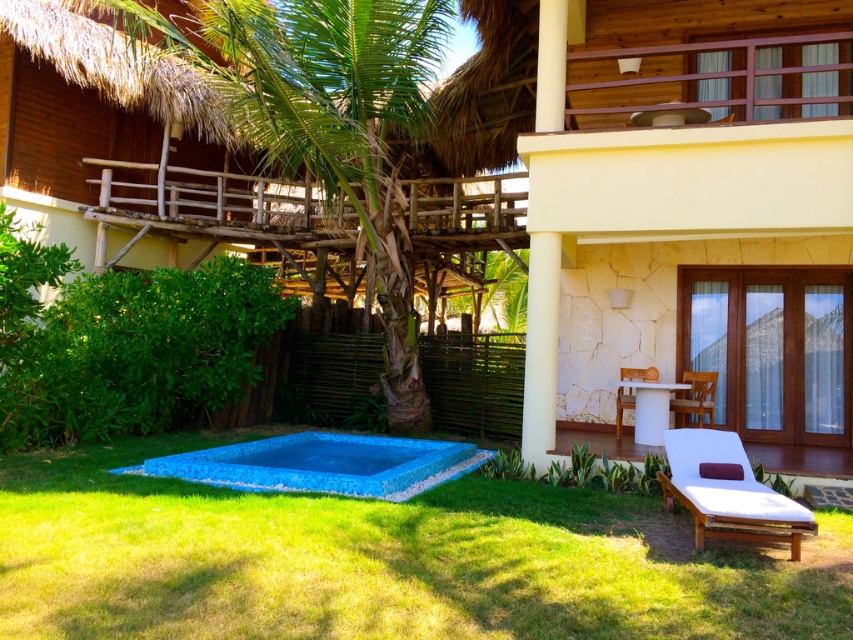
You are standing at the edge of the blue mosaic tiles at center and want to walk towards the green grass at lower center. In which direction should you move?

You should move to the right to reach the green grass at lower center since it is located to the right of the blue mosaic tiles at center.

Based on the photo, you are standing at the edge of the pool and want to walk to the white fabric chaise lounge at lower right. Which direction should you head to avoid stepping on the green grass at lower center?

You should head to the right of the white fabric chaise lounge at lower right to avoid stepping on the green grass at lower center, since the green grass at lower center is located to the left of the white fabric chaise lounge at lower right.

You are planning to lay a picnic blanket in the area shown. Considering the space available, which area would you choose between the green grass at lower center and the blue mosaic tiles at center?

The blue mosaic tiles at center occupy more space than the green grass at lower center, so you should choose the blue mosaic tiles at center for laying the picnic blanket as it provides a larger area.